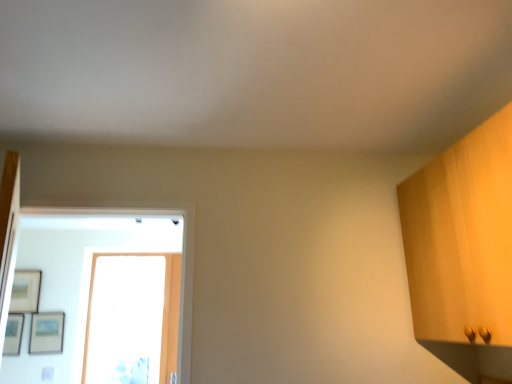
Question: Considering the relative sizes of transparent glass door at center and matte black picture frame at left, which is counted as the 2th picture frame, starting from the right, in the image provided, is transparent glass door at center bigger than matte black picture frame at left, which is counted as the 2th picture frame, starting from the right,?

Choices:
 (A) no
 (B) yes

Answer: (B)

Question: Can you confirm if transparent glass door at center is shorter than matte black picture frame at left, which is counted as the 2th picture frame, starting from the right?

Choices:
 (A) yes
 (B) no

Answer: (B)

Question: Considering the relative sizes of transparent glass door at center and matte black picture frame at left, marked as the second picture frame in a left-to-right arrangement, in the image provided, is transparent glass door at center thinner than matte black picture frame at left, marked as the second picture frame in a left-to-right arrangement,?

Choices:
 (A) yes
 (B) no

Answer: (B)

Question: Can you confirm if transparent glass door at center is wider than matte black picture frame at left, which is counted as the 2th picture frame, starting from the right?

Choices:
 (A) no
 (B) yes

Answer: (B)

Question: Is transparent glass door at center located outside matte black picture frame at left, which is counted as the 2th picture frame, starting from the right?

Choices:
 (A) yes
 (B) no

Answer: (A)

Question: From the image's perspective, is matte black picture frame at left, which is counted as the 2th picture frame, starting from the right, positioned above or below matte black picture frame at lower left, the first picture frame when ordered from right to left?

Choices:
 (A) above
 (B) below

Answer: (B)

Question: From a real-world perspective, is matte black picture frame at left, marked as the second picture frame in a left-to-right arrangement, physically located above or below matte black picture frame at lower left, the first picture frame when ordered from right to left?

Choices:
 (A) below
 (B) above

Answer: (A)

Question: Considering the positions of point (17, 354) and point (34, 324), is point (17, 354) closer or farther from the camera than point (34, 324)?

Choices:
 (A) farther
 (B) closer

Answer: (B)

Question: Relative to matte black picture frame at lower left, marked as the 3th picture frame in a left-to-right arrangement, is matte black picture frame at left, marked as the second picture frame in a left-to-right arrangement, in front or behind?

Choices:
 (A) front
 (B) behind

Answer: (A)

Question: From the image's perspective, is transparent glass door at center above or below matte wooden picture frame at upper left, arranged as the 1th picture frame when viewed from the left?

Choices:
 (A) below
 (B) above

Answer: (A)

Question: Considering the relative positions of transparent glass door at center and matte wooden picture frame at upper left, which is counted as the third picture frame, starting from the right, in the image provided, is transparent glass door at center to the left or to the right of matte wooden picture frame at upper left, which is counted as the third picture frame, starting from the right,?

Choices:
 (A) right
 (B) left

Answer: (A)

Question: Considering the positions of transparent glass door at center and matte wooden picture frame at upper left, arranged as the 1th picture frame when viewed from the left, in the image, is transparent glass door at center taller or shorter than matte wooden picture frame at upper left, arranged as the 1th picture frame when viewed from the left,?

Choices:
 (A) short
 (B) tall

Answer: (B)

Question: Is point click(x=86, y=324) positioned closer to the camera than point click(x=22, y=299)?

Choices:
 (A) closer
 (B) farther

Answer: (B)

Question: From the image's perspective, is transparent glass door at center positioned above or below matte black picture frame at lower left, marked as the 3th picture frame in a left-to-right arrangement?

Choices:
 (A) below
 (B) above

Answer: (B)

Question: Is point (168, 284) closer or farther from the camera than point (34, 344)?

Choices:
 (A) closer
 (B) farther

Answer: (A)